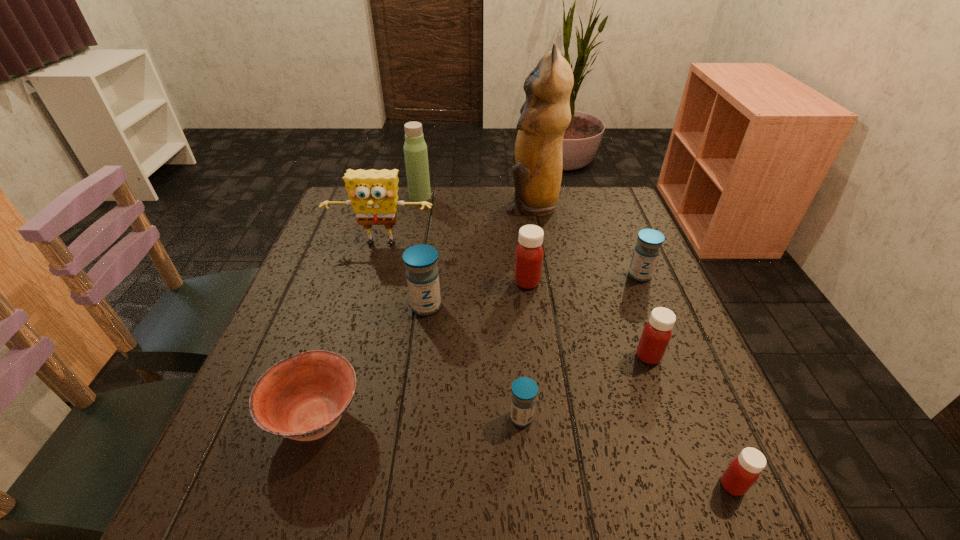
Locate an element on the screen. The height and width of the screenshot is (540, 960). the tallest object is located at coordinates (545, 115).

The width and height of the screenshot is (960, 540). I want to click on light thermos bottle, so click(x=415, y=149).

What are the coordinates of `the third farthest object` in the screenshot? It's located at (373, 194).

Locate an element on the screen. The height and width of the screenshot is (540, 960). sponge is located at coordinates (373, 194).

The height and width of the screenshot is (540, 960). Find the location of `the farthest red medicine`. the farthest red medicine is located at coordinates (529, 253).

I want to click on the biggest red medicine, so click(x=529, y=253).

Where is `the sixth farthest object`? Image resolution: width=960 pixels, height=540 pixels. the sixth farthest object is located at coordinates (422, 274).

Identify the location of the leftmost blue medicine. (422, 274).

You are a GUI agent. You are given a task and a screenshot of the screen. Output one action in this format:
    pyautogui.click(x=<x>, y=<y>)
    Task: Click on the second smallest blue medicine
    Image resolution: width=960 pixels, height=540 pixels.
    Given the screenshot: What is the action you would take?
    pyautogui.click(x=646, y=252)

The image size is (960, 540). Identify the location of the farthest blue medicine. (646, 252).